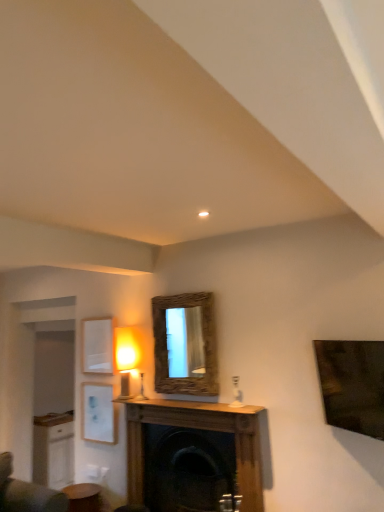
Question: Based on their sizes in the image, would you say white matte picture frame at lower left, the first picture frame in the bottom-to-top sequence, is bigger or smaller than wooden table at lower left?

Choices:
 (A) big
 (B) small

Answer: (B)

Question: From the image's perspective, is white matte picture frame at lower left, the 2th picture frame in the top-to-bottom sequence, above or below wooden table at lower left?

Choices:
 (A) below
 (B) above

Answer: (B)

Question: Which of these objects is positioned closest to the white matte picture frame at upper left, which appears as the second picture frame when ordered from the bottom?

Choices:
 (A) matte white glass at center, acting as the 1th table lamp starting from the right
 (B) wooden fireplace at center
 (C) wooden mirror at center
 (D) white matte picture frame at lower left, the 2th picture frame in the top-to-bottom sequence
 (E) wooden table at lower left

Answer: (D)

Question: Estimate the real-world distances between objects in this image. Which object is closer to the wooden fireplace at center?

Choices:
 (A) wooden table at lower left
 (B) wooden mirror at center
 (C) matte white table lamp at upper left, the 2th table lamp viewed from the right
 (D) white matte picture frame at lower left, the first picture frame in the bottom-to-top sequence
 (E) white matte picture frame at upper left, the first picture frame from the top

Answer: (B)